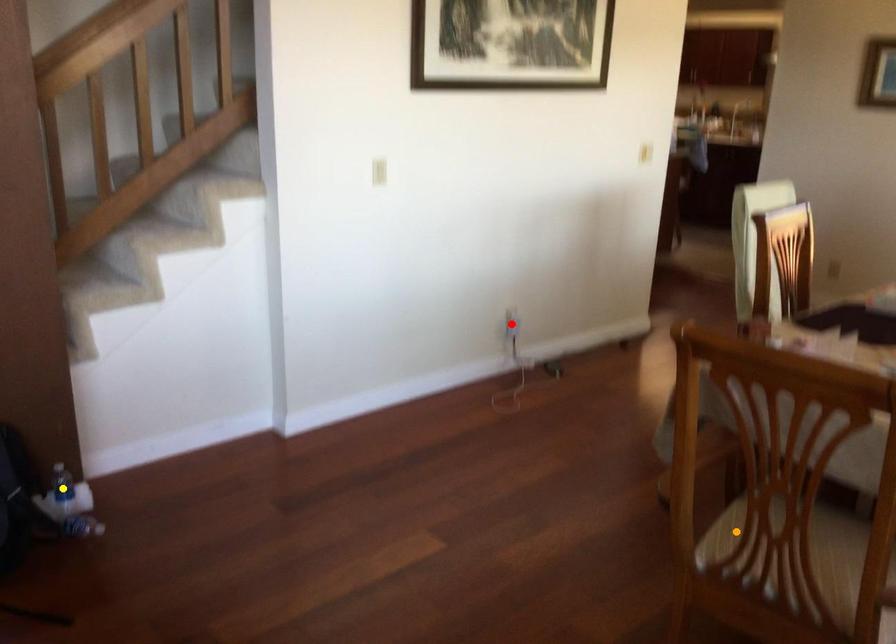
Order these from nearest to farthest:
A) red point
B) orange point
C) yellow point

orange point, yellow point, red point